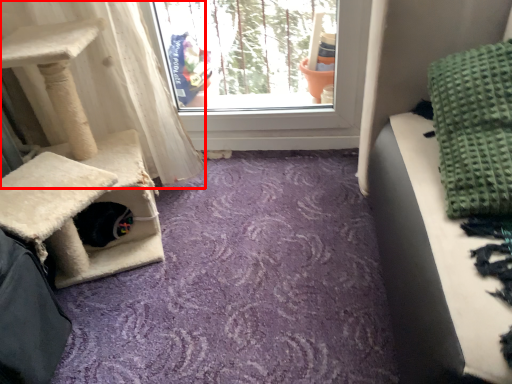
Question: Where is curtain (annotated by the red box) located in relation to blanket in the image?

Choices:
 (A) left
 (B) right

Answer: (A)